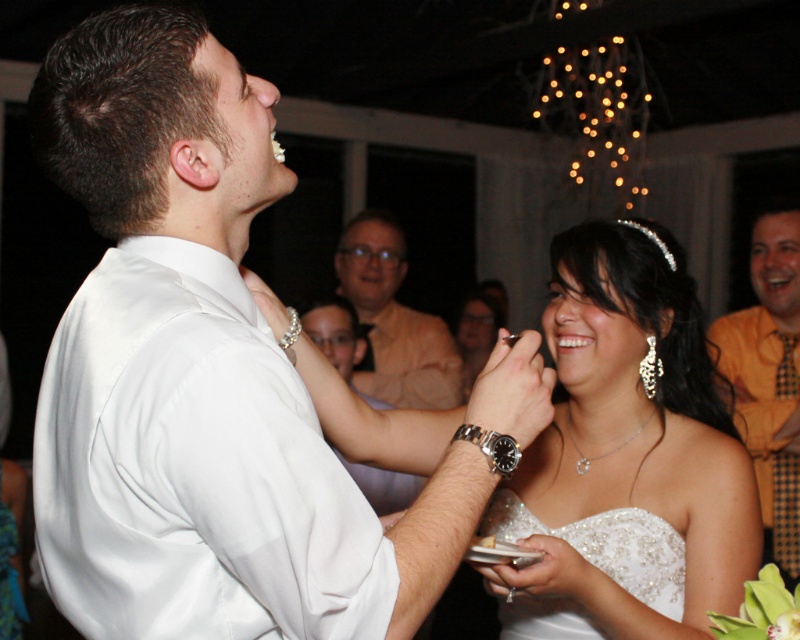
Question: Is white satin dress at center below white beaded dress at center?

Choices:
 (A) yes
 (B) no

Answer: (B)

Question: Is white satin dress at center to the left of pearl necklace at upper center from the viewer's perspective?

Choices:
 (A) no
 (B) yes

Answer: (B)

Question: Is orange textured shirt at right positioned at the back of matte beige shirt at center?

Choices:
 (A) yes
 (B) no

Answer: (B)

Question: Which point is farther to the camera?

Choices:
 (A) pearl necklace at upper center
 (B) matte beige shirt at center
 (C) orange textured shirt at right
 (D) white beaded dress at center

Answer: (B)

Question: Based on their relative distances, which object is farther from the matte beige shirt at center?

Choices:
 (A) white beaded dress at center
 (B) orange textured shirt at right

Answer: (A)

Question: Among these points, which one is nearest to the camera?

Choices:
 (A) (602, 237)
 (B) (674, 532)
 (C) (774, 381)
 (D) (458, 396)

Answer: (B)